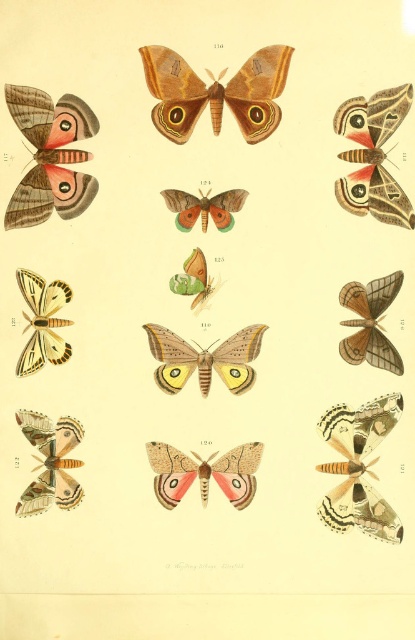
You are an entomologist examining the image of moths. You need to locate the matte brown butterfly at center. What are its coordinates?

The matte brown butterfly at center is located at coordinates [215,92].